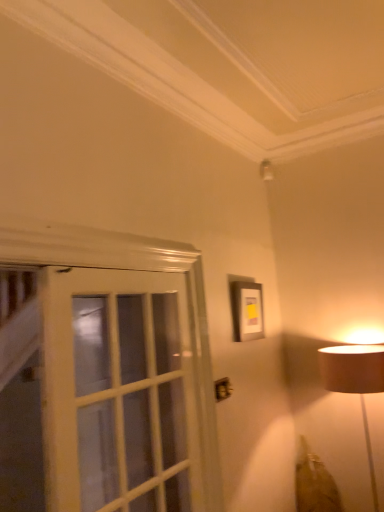
Question: In the image, is matte black picture frame at upper center positioned in front of or behind white glass screen door at left?

Choices:
 (A) front
 (B) behind

Answer: (B)

Question: Which is correct: matte black picture frame at upper center is inside white glass screen door at left, or outside of it?

Choices:
 (A) outside
 (B) inside

Answer: (A)

Question: From a real-world perspective, relative to white glass screen door at left, is matte black picture frame at upper center vertically above or below?

Choices:
 (A) above
 (B) below

Answer: (A)

Question: In the image, is white glass screen door at left positioned in front of or behind matte black picture frame at upper center?

Choices:
 (A) behind
 (B) front

Answer: (B)

Question: From the image's perspective, is white glass screen door at left located above or below matte black picture frame at upper center?

Choices:
 (A) above
 (B) below

Answer: (B)

Question: Is white glass screen door at left taller or shorter than matte black picture frame at upper center?

Choices:
 (A) tall
 (B) short

Answer: (A)

Question: From a real-world perspective, relative to matte black picture frame at upper center, is white glass screen door at left vertically above or below?

Choices:
 (A) above
 (B) below

Answer: (B)